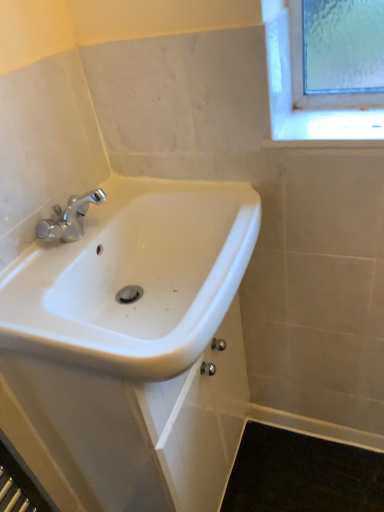
Question: Should I look upward or downward to see white glossy sink at center?

Choices:
 (A) down
 (B) up

Answer: (A)